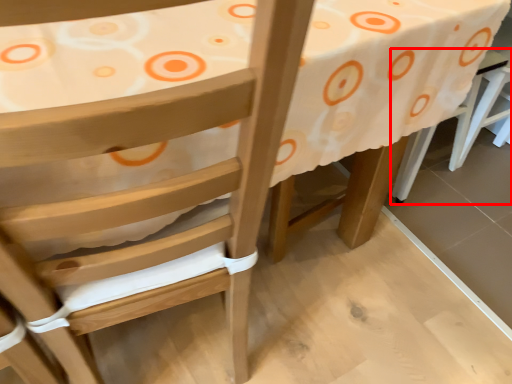
Question: Where is chair (annotated by the red box) located in relation to table in the image?

Choices:
 (A) left
 (B) right

Answer: (B)